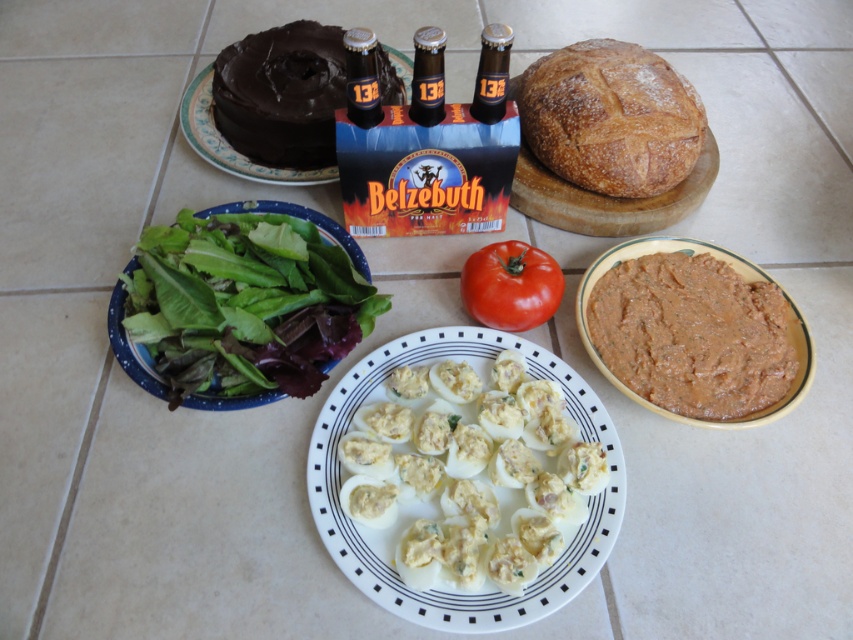
Question: Which object is farther from the camera taking this photo?

Choices:
 (A) chocolate matte cake at upper center
 (B) green leafymaterial/texturevegetable at left

Answer: (A)

Question: Is white creamy deviled eggs at center thinner than red matte tomato at center?

Choices:
 (A) yes
 (B) no

Answer: (B)

Question: Which object is positioned closest to the chocolate matte cake at upper center?

Choices:
 (A) golden brown crusty loaf of bread at upper right
 (B) matte glass bottle at upper center

Answer: (B)

Question: Does white creamy deviled eggs at center have a larger size compared to matte glass bottle at upper center?

Choices:
 (A) yes
 (B) no

Answer: (A)

Question: Which of the following is the closest to the observer?

Choices:
 (A) (500, 256)
 (B) (357, 44)

Answer: (B)

Question: Is matte brown bottle at center closer to the viewer compared to matte glass bottle at upper center?

Choices:
 (A) yes
 (B) no

Answer: (A)